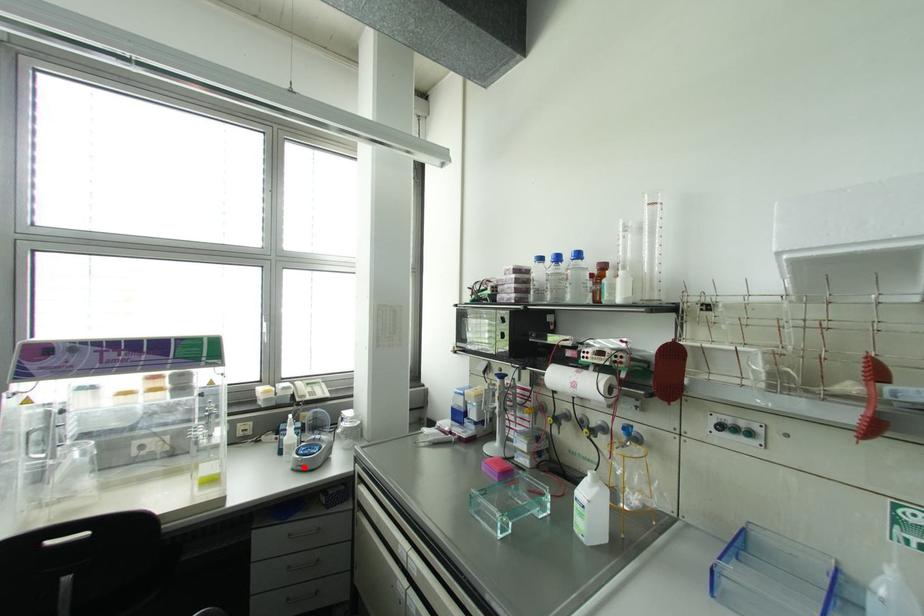
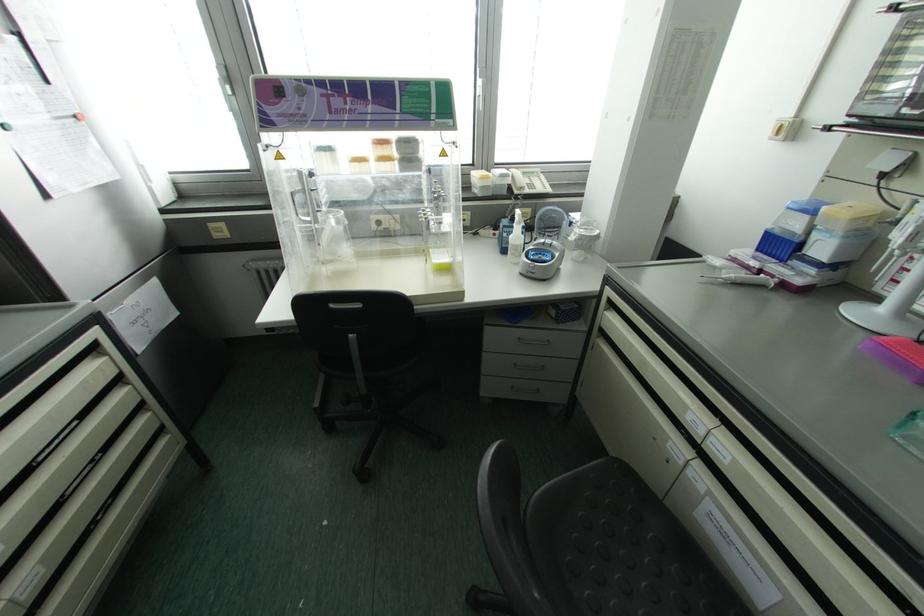
Where in the second image is the point corresponding to the highlighted location from the first image?

(536, 275)